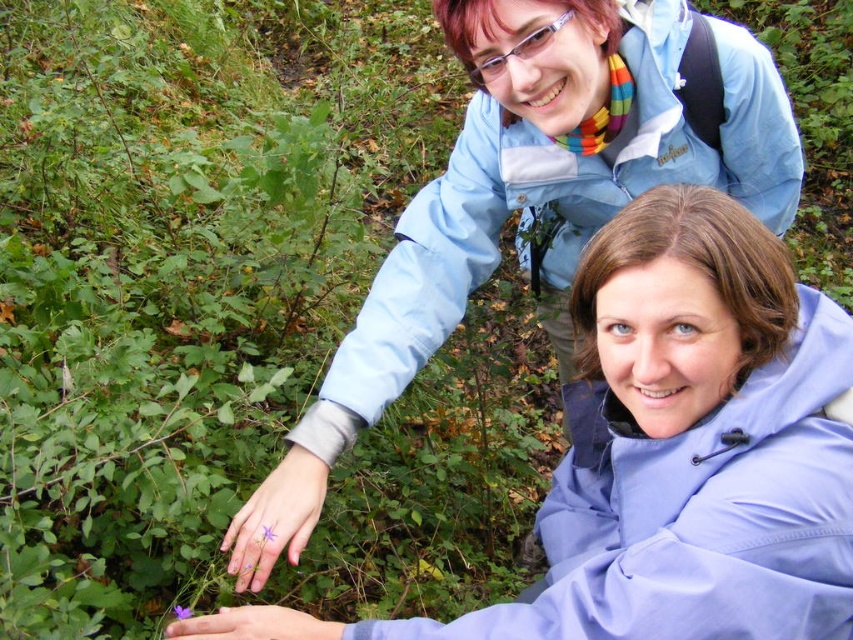
From the picture: Who is more distant from viewer, (746, 432) or (657, 152)?

Positioned behind is point (657, 152).

Who is higher up, matte blue jacket at upper center or light blue fabric jacket at upper center?

light blue fabric jacket at upper center is higher up.

The width and height of the screenshot is (853, 640). I want to click on matte blue jacket at upper center, so click(675, 452).